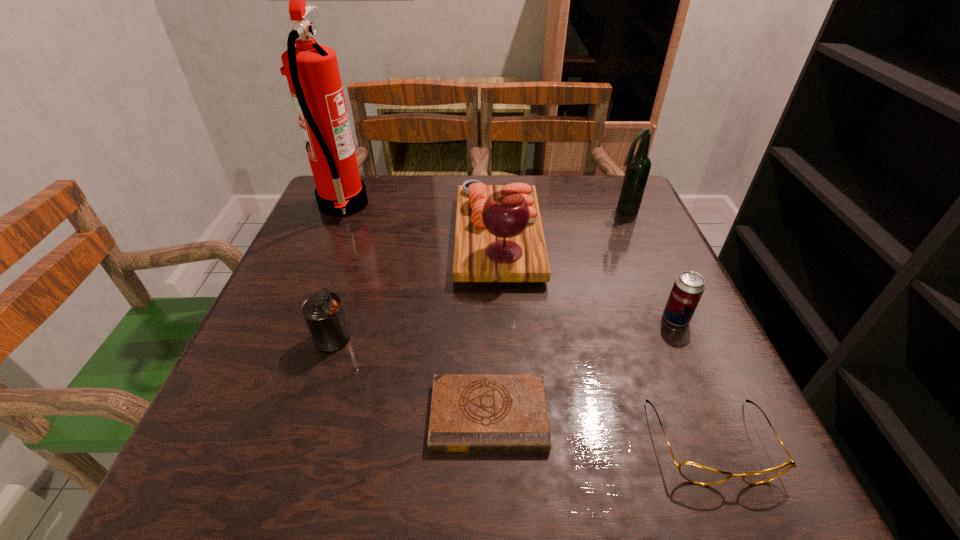
The width and height of the screenshot is (960, 540). I want to click on the tallest object, so click(x=312, y=72).

Locate an element on the screen. beer bottle is located at coordinates tap(638, 167).

I want to click on platter, so click(x=498, y=237).

You are a GUI agent. You are given a task and a screenshot of the screen. Output one action in this format:
    pyautogui.click(x=<x>, y=<y>)
    Task: Click on the can
    The height and width of the screenshot is (540, 960).
    Given the screenshot: What is the action you would take?
    pyautogui.click(x=323, y=312)

Where is `beer can`? The width and height of the screenshot is (960, 540). beer can is located at coordinates (688, 288).

At what (x,y) coordinates should I click in order to perform the action: click on spectacles. Please return your answer as a coordinate pair (x, y). This screenshot has width=960, height=540. Looking at the image, I should click on (693, 472).

The width and height of the screenshot is (960, 540). Identify the location of the shortest object. point(469,412).

Where is `free space located with the nozzle aimed from the tallest object`? The height and width of the screenshot is (540, 960). free space located with the nozzle aimed from the tallest object is located at coordinates (475, 206).

Find the location of a particular element. Image resolution: width=960 pixels, height=540 pixels. blank space located 0.200m on the front of the beer bottle is located at coordinates (650, 267).

Locate an element on the screen. Image resolution: width=960 pixels, height=540 pixels. free spot located on the back of the fifth shortest object is located at coordinates (495, 179).